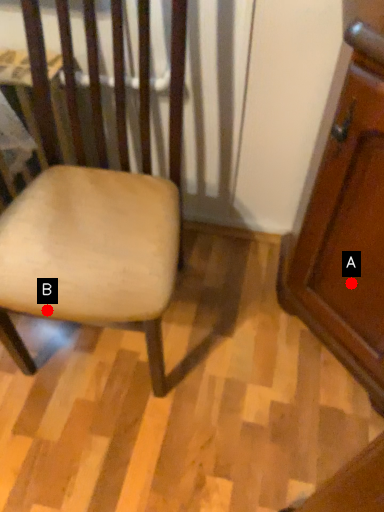
Question: Two points are circled on the image, labeled by A and B beside each circle. Which of the following is the farthest from the observer?

Choices:
 (A) A is further
 (B) B is further

Answer: (A)